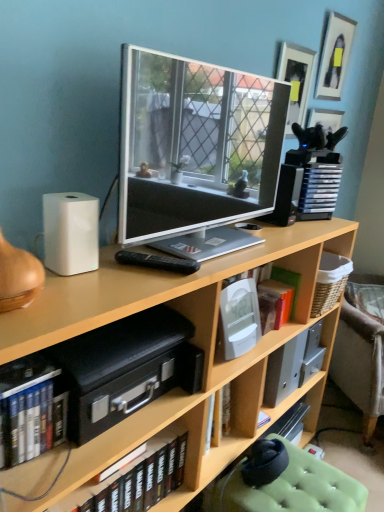
I want to click on hardcover book at center, the 3th book when ordered from top to bottom, so click(136, 478).

Describe the element at coordinates (136, 478) in the screenshot. The width and height of the screenshot is (384, 512). I see `hardcover book at center, which appears as the 2th book when viewed from the front` at that location.

Describe the element at coordinates (279, 298) in the screenshot. The height and width of the screenshot is (512, 384). I see `orange matte book at center-right, the 1th book from the back` at that location.

The image size is (384, 512). Describe the element at coordinates (334, 56) in the screenshot. I see `matte black picture frame at upper right, which appears as the first picture frame when viewed from the right` at that location.

What do you see at coordinates (360, 362) in the screenshot?
I see `woven basket at lower right` at bounding box center [360, 362].

Image resolution: width=384 pixels, height=512 pixels. Describe the element at coordinates (286, 196) in the screenshot. I see `white plastic speaker at right, the 2th speaker positioned from the left` at that location.

I want to click on hardcover book at center, acting as the second book starting from the back, so click(x=136, y=478).

Which object is wider, woven basket at lower right or matte black picture frame at upper right, the second picture frame viewed from the right?

woven basket at lower right is wider.

From a real-world perspective, who is located lower, woven basket at lower right or matte black picture frame at upper right, the second picture frame viewed from the right?

In real-world perspective, woven basket at lower right is lower.

Is woven basket at lower right far from matte black picture frame at upper right, the first picture frame from the left?

Yes, woven basket at lower right and matte black picture frame at upper right, the first picture frame from the left, are quite far apart.

Is point (336, 356) less distant than point (286, 75)?

No, (336, 356) is further to viewer.

Can you confirm if black matte printer at lower center is shorter than matte black picture frame at upper right, the first picture frame from the left?

Yes.

From a real-world perspective, is black matte printer at lower center physically below matte black picture frame at upper right, the second picture frame viewed from the right?

Yes, from a real-world perspective, black matte printer at lower center is beneath matte black picture frame at upper right, the second picture frame viewed from the right.

Is black matte printer at lower center wider than matte black picture frame at upper right, the first picture frame from the left?

Correct, the width of black matte printer at lower center exceeds that of matte black picture frame at upper right, the first picture frame from the left.

Is black matte printer at lower center directly adjacent to matte black picture frame at upper right, the second picture frame viewed from the right?

There is a gap between black matte printer at lower center and matte black picture frame at upper right, the second picture frame viewed from the right.

In the scene shown: From a real-world perspective, is matte black picture frame at upper right, the second picture frame viewed from the right, on top of green fabric swivel chair at lower right?

Yes, from a real-world perspective, matte black picture frame at upper right, the second picture frame viewed from the right, is over green fabric swivel chair at lower right

Can you see matte black picture frame at upper right, the first picture frame from the left, touching green fabric swivel chair at lower right?

No, matte black picture frame at upper right, the first picture frame from the left, is not with green fabric swivel chair at lower right.

Can you confirm if matte black picture frame at upper right, the first picture frame from the left, is positioned to the left of green fabric swivel chair at lower right?

In fact, matte black picture frame at upper right, the first picture frame from the left, is to the right of green fabric swivel chair at lower right.

From the image's perspective, is matte black picture frame at upper right, the second picture frame viewed from the right, above green fabric swivel chair at lower right?

Yes, from the image's perspective, matte black picture frame at upper right, the second picture frame viewed from the right, is above green fabric swivel chair at lower right.

Considering the sizes of light brown wood bookcase at center and matte black picture frame at upper right, the first picture frame from the left, in the image, is light brown wood bookcase at center bigger or smaller than matte black picture frame at upper right, the first picture frame from the left,?

Considering their sizes, light brown wood bookcase at center takes up more space than matte black picture frame at upper right, the first picture frame from the left.

From the picture: What's the angular difference between light brown wood bookcase at center and matte black picture frame at upper right, the second picture frame viewed from the right,'s facing directions?

There is a 0.248-degree angle between the facing directions of light brown wood bookcase at center and matte black picture frame at upper right, the second picture frame viewed from the right.

Is light brown wood bookcase at center positioned before matte black picture frame at upper right, the second picture frame viewed from the right?

Yes, light brown wood bookcase at center is closer to the camera.

Can you confirm if light brown wood bookcase at center is positioned to the right of matte black picture frame at upper right, the second picture frame viewed from the right?

In fact, light brown wood bookcase at center is to the left of matte black picture frame at upper right, the second picture frame viewed from the right.

Is there a large distance between orange matte book at center-right, which is the 3th book in front-to-back order, and white matte speaker at left, the 2th speaker from the top?

That's not correct — orange matte book at center-right, which is the 3th book in front-to-back order, is a little close to white matte speaker at left, the 2th speaker from the top.

Considering the relative positions of orange matte book at center-right, positioned as the first book in right-to-left order, and white matte speaker at left, positioned as the first speaker in left-to-right order, in the image provided, is orange matte book at center-right, positioned as the first book in right-to-left order, to the left or to the right of white matte speaker at left, positioned as the first speaker in left-to-right order,?

In the image, orange matte book at center-right, positioned as the first book in right-to-left order, appears on the right side of white matte speaker at left, positioned as the first speaker in left-to-right order.

Is the position of orange matte book at center-right, marked as the first book in a top-to-bottom arrangement, less distant than that of white matte speaker at left, acting as the second speaker starting from the right?

No, it is behind white matte speaker at left, acting as the second speaker starting from the right.

Can you confirm if orange matte book at center-right, the 3th book viewed from the left, is smaller than white matte speaker at left, the 2th speaker from the top?

No, orange matte book at center-right, the 3th book viewed from the left, is not smaller than white matte speaker at left, the 2th speaker from the top.

Does hardcover book at center, the 3th book when ordered from top to bottom, have a greater height compared to green fabric swivel chair at lower right?

Incorrect, the height of hardcover book at center, the 3th book when ordered from top to bottom, is not larger of that of green fabric swivel chair at lower right.

Image resolution: width=384 pixels, height=512 pixels. Identify the location of swivel chair below the hardcover book at center, which is the 2th book in left-to-right order (from a real-world perspective). (290, 486).

Between hardcover book at center, which appears as the 2th book when viewed from the front, and green fabric swivel chair at lower right, which one appears on the right side from the viewer's perspective?

green fabric swivel chair at lower right.

Is black matte printer at lower center at the back of matte black picture frame at upper right, the 2th picture frame from the left?

No.

Is matte black picture frame at upper right, the 2th picture frame from the left, far away from black matte printer at lower center?

Absolutely, matte black picture frame at upper right, the 2th picture frame from the left, is distant from black matte printer at lower center.

This screenshot has height=512, width=384. What are the coordinates of `printer on the left of matte black picture frame at upper right, the 2th picture frame from the left` in the screenshot? It's located at (126, 368).

Where is `furniture behind the matte black picture frame at upper right, the first picture frame from the left`? The height and width of the screenshot is (512, 384). furniture behind the matte black picture frame at upper right, the first picture frame from the left is located at coordinates (360, 362).

Where is `printer in front of the matte black picture frame at upper right, the second picture frame viewed from the right`? The width and height of the screenshot is (384, 512). printer in front of the matte black picture frame at upper right, the second picture frame viewed from the right is located at coordinates (126, 368).

From the image, which object appears to be farther from white plastic speaker at right, the 2th speaker positioned from the left, matte black picture frame at upper right, the 2th picture frame from the left, or black plastic remote at center?

matte black picture frame at upper right, the 2th picture frame from the left, is further to white plastic speaker at right, the 2th speaker positioned from the left.

Consider the image. Which object lies nearer to the anchor point orange matte book at center-right, the 3th book viewed from the left, white plastic speaker at right, marked as the first speaker in a right-to-left arrangement, or hardcover book at center, which is the second book in right-to-left order?

white plastic speaker at right, marked as the first speaker in a right-to-left arrangement, is closer to orange matte book at center-right, the 3th book viewed from the left.

Which object lies further to the anchor point woven basket at lower right, black plastic remote at center or orange matte book at center-right, which is the 3th book in front-to-back order?

black plastic remote at center.

Based on their spatial positions, is black matte printer at lower center or green fabric swivel chair at lower right closer to matte silver tv at center?

black matte printer at lower center is closer to matte silver tv at center.

When comparing their distances from matte silver tv at center, does white plastic speaker at right, the 2th speaker positioned from the left, or hardcover books at lower left, acting as the second book starting from the top, seem further?

hardcover books at lower left, acting as the second book starting from the top, lies further to matte silver tv at center than the other object.

Considering their positions, is white matte speaker at left, positioned as the first speaker in left-to-right order, positioned further to matte black picture frame at upper right, which appears as the first picture frame when viewed from the right, than matte silver tv at center?

white matte speaker at left, positioned as the first speaker in left-to-right order, is positioned further to the anchor matte black picture frame at upper right, which appears as the first picture frame when viewed from the right.

Estimate the real-world distances between objects in this image. Which object is closer to matte silver tv at center, hardcover book at center, which appears as the 2th book when viewed from the front, or matte black picture frame at upper right, the second picture frame viewed from the right?

The object closer to matte silver tv at center is matte black picture frame at upper right, the second picture frame viewed from the right.

Looking at the image, which one is located closer to white plastic speaker at right, marked as the 2th speaker in a front-to-back arrangement, matte silver tv at center or green fabric swivel chair at lower right?

The object closer to white plastic speaker at right, marked as the 2th speaker in a front-to-back arrangement, is matte silver tv at center.

The height and width of the screenshot is (512, 384). What are the coordinates of `remote control positioned between white matte speaker at left, positioned as the first speaker in left-to-right order, and matte black picture frame at upper right, the first picture frame from the left, from near to far` in the screenshot? It's located at (158, 262).

This screenshot has width=384, height=512. Find the location of `picture frame between matte black picture frame at upper right, which appears as the first picture frame when viewed from the right, and light brown wood bookcase at center from top to bottom`. picture frame between matte black picture frame at upper right, which appears as the first picture frame when viewed from the right, and light brown wood bookcase at center from top to bottom is located at coordinates (295, 80).

Locate an element on the screen. The image size is (384, 512). television that lies between matte black picture frame at upper right, which appears as the first picture frame when viewed from the right, and black matte printer at lower center from top to bottom is located at coordinates (196, 151).

Locate an element on the screen. The width and height of the screenshot is (384, 512). remote control between matte black picture frame at upper right, which appears as the first picture frame when viewed from the right, and orange matte book at center-right, marked as the first book in a top-to-bottom arrangement, in the up-down direction is located at coordinates (158, 262).